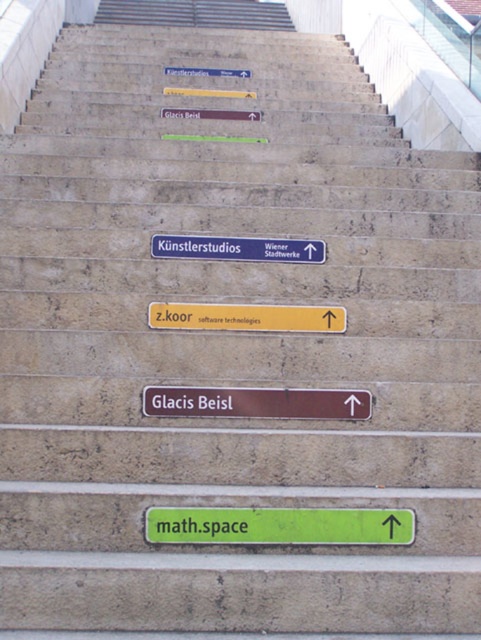
The image size is (481, 640). I want to click on blue plastic sign at center, so click(238, 248).

Between point (153, 241) and point (182, 115), which one is positioned behind?

Positioned behind is point (182, 115).

Identify the location of blue plastic sign at center. The height and width of the screenshot is (640, 481). (238, 248).

Does brown matte sign at center have a greater height compared to matte brown sign at center?

No, brown matte sign at center is not taller than matte brown sign at center.

Between brown matte sign at center and matte brown sign at center, which one is positioned lower?

Positioned lower is brown matte sign at center.

Image resolution: width=481 pixels, height=640 pixels. I want to click on brown matte sign at center, so click(x=255, y=403).

Does green matte sign at center appear under matte blue sign at upper center?

Correct, green matte sign at center is located below matte blue sign at upper center.

Can you confirm if green matte sign at center is taller than matte blue sign at upper center?

Incorrect, green matte sign at center's height is not larger of matte blue sign at upper center's.

Is point (144, 516) positioned before point (213, 76)?

Yes, it is in front of point (213, 76).

The image size is (481, 640). I want to click on green matte sign at center, so click(x=278, y=525).